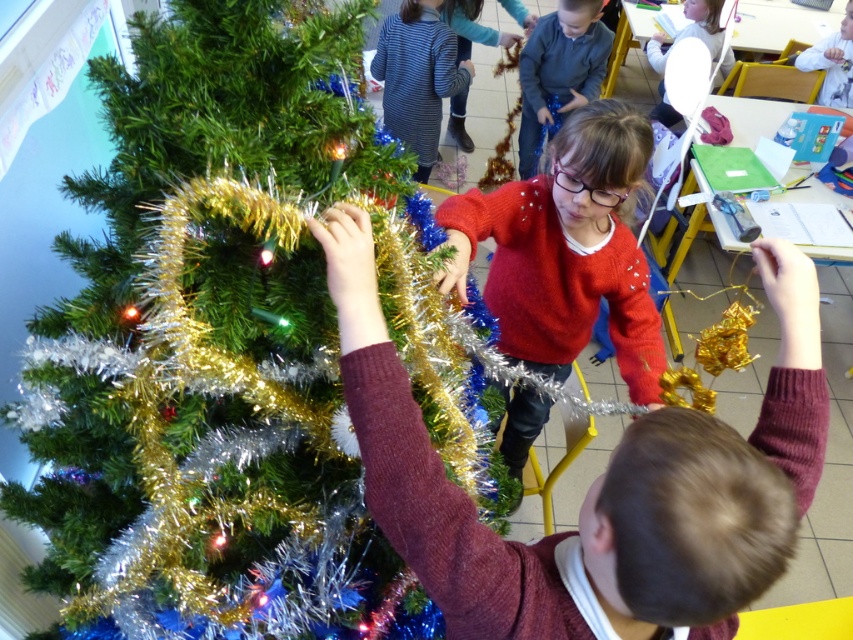
Question: Which object is farther from the camera taking this photo?

Choices:
 (A) gray wool sweater at upper center
 (B) shiny metallic tinsel at center
 (C) white fabric shirt at center
 (D) maroon sweater at center

Answer: (C)

Question: Which is nearer to the striped fabric dress at upper center?

Choices:
 (A) white fabric shirt at center
 (B) gray wool sweater at upper center
 (C) red sweater at center
 (D) shiny metallic tinsel at center

Answer: (B)

Question: Which point is closer to the camera?

Choices:
 (A) (560, 202)
 (B) (836, 38)
 (C) (569, 33)
 (D) (699, 496)

Answer: (D)

Question: Can you confirm if shiny metallic tinsel at center is smaller than white fabric shirt at center?

Choices:
 (A) yes
 (B) no

Answer: (B)

Question: Can you confirm if gray wool sweater at upper center is wider than white fabric shirt at center?

Choices:
 (A) no
 (B) yes

Answer: (B)

Question: Does shiny metallic tinsel at center come behind striped fabric dress at upper center?

Choices:
 (A) yes
 (B) no

Answer: (B)